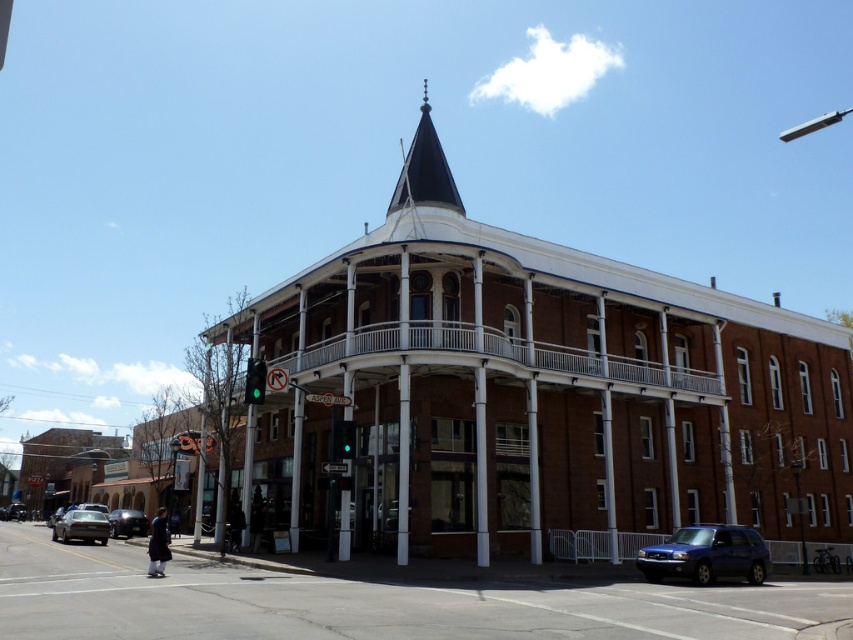
Question: Which point appears farthest from the camera in this image?

Choices:
 (A) (122, 516)
 (B) (495, 624)

Answer: (A)

Question: Is brick sidewalk at lower center to the left of black matte spire at upper center from the viewer's perspective?

Choices:
 (A) yes
 (B) no

Answer: (A)

Question: Which object is the farthest from the green glass traffic light at upper center?

Choices:
 (A) brick sidewalk at lower center
 (B) black matte spire at upper center
 (C) shiny silver sedan at lower left

Answer: (C)

Question: Can you confirm if blue matte suv at lower right is thinner than matte black sedan at lower left?

Choices:
 (A) yes
 (B) no

Answer: (B)

Question: Where is black matte spire at upper center located in relation to green glass traffic light at center in the image?

Choices:
 (A) right
 (B) left

Answer: (A)

Question: Which of the following is the closest to the observer?

Choices:
 (A) green glass traffic light at center
 (B) blue matte suv at lower right

Answer: (B)